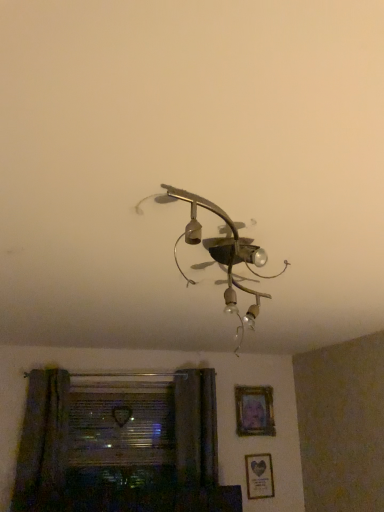
Question: Is transparent glass window at lower left inside or outside of green fabric curtain at lower left?

Choices:
 (A) outside
 (B) inside

Answer: (A)

Question: Based on their positions, is transparent glass window at lower left located to the left or right of green fabric curtain at lower left?

Choices:
 (A) left
 (B) right

Answer: (B)

Question: Considering the real-world distances, which object is closest to the transparent glass window at lower left?

Choices:
 (A) green fabric curtain at lower left
 (B) metallic chandelier at center
 (C) matte gold picture frame at lower right, positioned as the 2th picture frame in top-to-bottom order
 (D) wooden frame at upper center, the second picture frame positioned from the bottom

Answer: (A)

Question: Estimate the real-world distances between objects in this image. Which object is closer to the matte gold picture frame at lower right, the first picture frame when ordered from bottom to top?

Choices:
 (A) green fabric curtain at lower left
 (B) metallic chandelier at center
 (C) wooden frame at upper center, positioned as the 1th picture frame in top-to-bottom order
 (D) transparent glass window at lower left

Answer: (C)